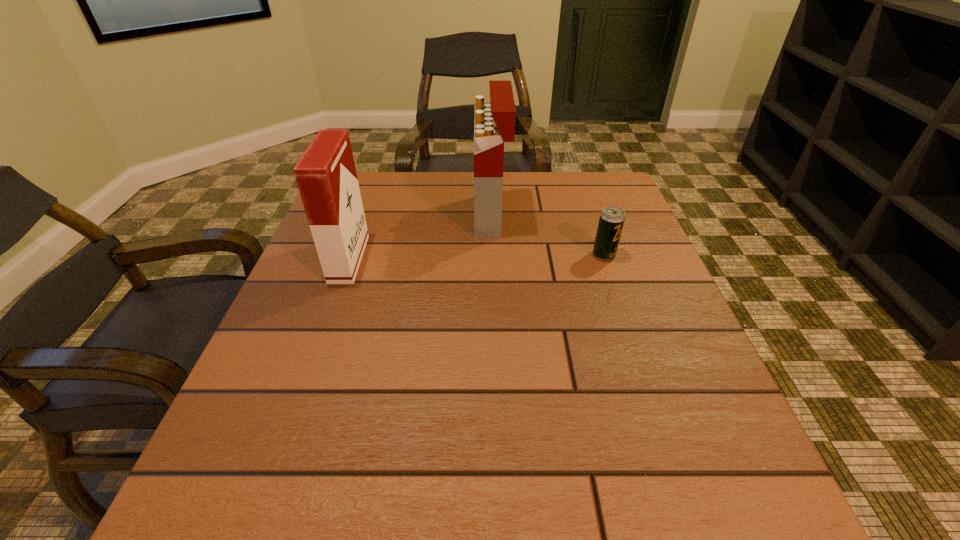
Image resolution: width=960 pixels, height=540 pixels. Find the location of `object that is at the left edge`. object that is at the left edge is located at coordinates (326, 176).

Identify the location of object positioned at the right edge. pos(611,221).

In the image, there is a desktop. Where is `vacant area at the far edge`? The height and width of the screenshot is (540, 960). vacant area at the far edge is located at coordinates (427, 207).

In the image, there is a desktop. Identify the location of vacant space at the left edge. (311, 268).

Locate an element on the screen. Image resolution: width=960 pixels, height=540 pixels. vacant region at the right edge of the desktop is located at coordinates (667, 426).

Find the location of a particular element. The height and width of the screenshot is (540, 960). free spot at the far left corner of the desktop is located at coordinates (390, 187).

Where is `vacant space at the near left corner of the desktop`? vacant space at the near left corner of the desktop is located at coordinates (269, 503).

Identify the location of vacant space at the far right corner of the desktop. The image size is (960, 540). (561, 192).

In the image, there is a desktop. Identify the location of vacant space at the near right corner. (679, 503).

Where is `free space between the left cigarette_case and the rightmost object`? free space between the left cigarette_case and the rightmost object is located at coordinates (476, 257).